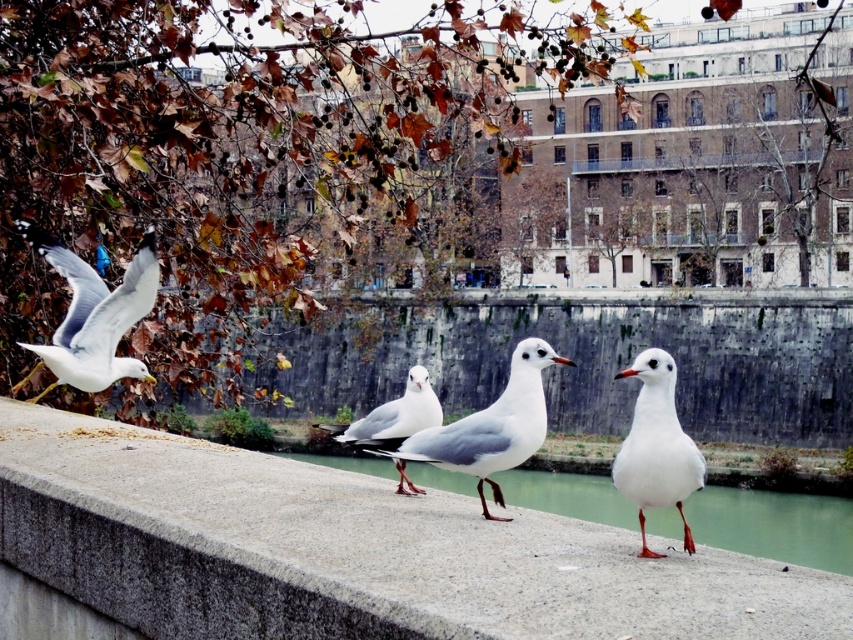
Question: Estimate the real-world distances between objects in this image. Which object is closer to the gray concrete at center?

Choices:
 (A) white matte bird at center
 (B) white glossy seagull at left

Answer: (A)

Question: Which of the following is the closest to the observer?

Choices:
 (A) (531, 428)
 (B) (642, 381)
 (C) (90, 442)

Answer: (B)

Question: Does white matte bird at center appear under white matte seagull at center?

Choices:
 (A) yes
 (B) no

Answer: (A)

Question: Can you confirm if white matte/glossy seagull at center is positioned to the left of white matte seagull at center?

Choices:
 (A) yes
 (B) no

Answer: (B)

Question: Among these objects, which one is farthest from the camera?

Choices:
 (A) white matte bird at center
 (B) white matte/glossy seagull at center
 (C) white matte seagull at center
 (D) gray concrete at center

Answer: (C)

Question: Can you confirm if gray concrete at center is smaller than white glossy seagull at left?

Choices:
 (A) yes
 (B) no

Answer: (B)